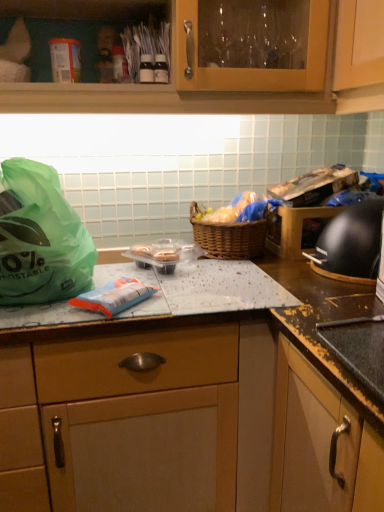
Identify the location of free space above black granite countertop at center (from a real-world perspective). The width and height of the screenshot is (384, 512). (211, 278).